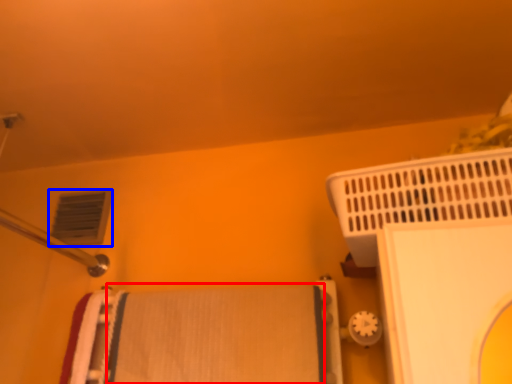
Question: Which point is closer to the camera, bath towel (highlighted by a red box) or air conditioning (highlighted by a blue box)?

Choices:
 (A) bath towel
 (B) air conditioning

Answer: (A)